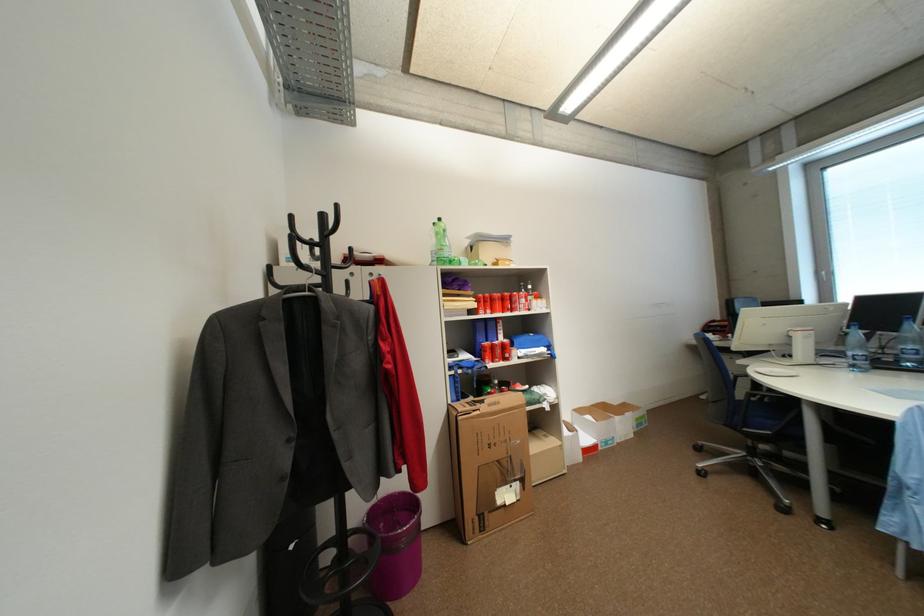
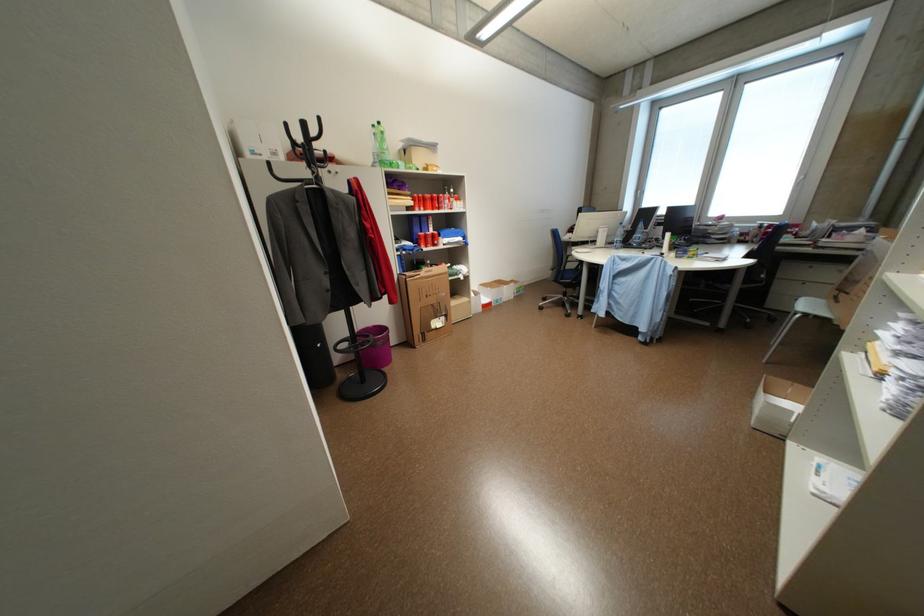
In the second image, find the point that corresponds to [588,411] in the first image.

(492, 286)